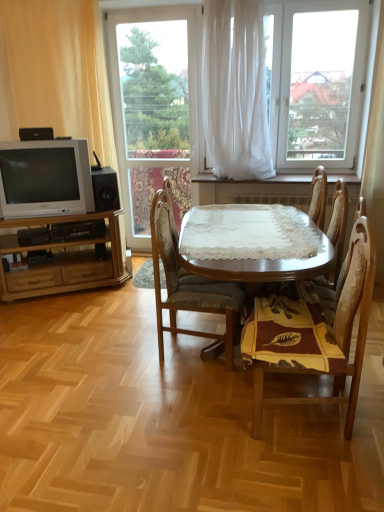
Describe the element at coordinates (45, 178) in the screenshot. I see `matte silver television at left` at that location.

The height and width of the screenshot is (512, 384). Identify the location of matte silver television at left. [45, 178].

Where is `transparent glass window at center, arranged as the 1th window when viewed from the left`? transparent glass window at center, arranged as the 1th window when viewed from the left is located at coordinates (155, 106).

Measure the distance between transparent glass window at center, arranged as the 1th window when viewed from the left, and camera.

They are 11.36 feet apart.

Measure the distance between black matte speaker at lower left, which appears as the first loudspeaker when viewed from the right, and camera.

Result: The depth of black matte speaker at lower left, which appears as the first loudspeaker when viewed from the right, is 11.35 feet.

Describe the element at coordinates (36, 134) in the screenshot. I see `black plastic speaker at upper left, which ranks as the second loudspeaker in right-to-left order` at that location.

Where is `light brown wood entertainment center at left`? light brown wood entertainment center at left is located at coordinates (61, 260).

This screenshot has width=384, height=512. What do you see at coordinates (315, 81) in the screenshot?
I see `white sheer curtain at upper center, placed as the second window when sorted from left to right` at bounding box center [315, 81].

At what (x,y) coordinates should I click in order to perform the action: click on white sheer curtain at center, the 2th curtain positioned from the left. Please return your answer as a coordinate pair (x, y). Looking at the image, I should click on (235, 89).

What's the angular difference between wooden chair at center, the second chair positioned from the right, and light brown wood entertainment center at left's facing directions?

120 degrees.

Considering the relative sizes of wooden chair at center, the second chair positioned from the right, and light brown wood entertainment center at left in the image provided, is wooden chair at center, the second chair positioned from the right, bigger than light brown wood entertainment center at left?

No, wooden chair at center, the second chair positioned from the right, is not bigger than light brown wood entertainment center at left.

Considering the relative positions of wooden chair at center, arranged as the 2th chair when viewed from the left, and light brown wood entertainment center at left in the image provided, is wooden chair at center, arranged as the 2th chair when viewed from the left, to the left or to the right of light brown wood entertainment center at left?

In the image, wooden chair at center, arranged as the 2th chair when viewed from the left, appears on the right side of light brown wood entertainment center at left.

Is wooden chair at center, arranged as the 2th chair when viewed from the left, facing away from light brown wood entertainment center at left?

No, wooden chair at center, arranged as the 2th chair when viewed from the left,'s orientation is not away from light brown wood entertainment center at left.

Is white sheer curtain at center, the 1th curtain in the right-to-left sequence, oriented away from wooden chair at center, the second chair positioned from the right?

No, wooden chair at center, the second chair positioned from the right, is not at the back of white sheer curtain at center, the 1th curtain in the right-to-left sequence.

Considering the sizes of objects white sheer curtain at center, the 2th curtain positioned from the left, and wooden chair at center, arranged as the 2th chair when viewed from the left, in the image provided, who is bigger, white sheer curtain at center, the 2th curtain positioned from the left, or wooden chair at center, arranged as the 2th chair when viewed from the left,?

Bigger between the two is white sheer curtain at center, the 2th curtain positioned from the left.

Can you confirm if white sheer curtain at center, the 1th curtain in the right-to-left sequence, is taller than wooden chair at center, arranged as the 2th chair when viewed from the left?

Correct, white sheer curtain at center, the 1th curtain in the right-to-left sequence, is much taller as wooden chair at center, arranged as the 2th chair when viewed from the left.

Considering the relative positions of black plastic speaker at upper left, which is the 1th loudspeaker from left to right, and wooden table at center in the image provided, is black plastic speaker at upper left, which is the 1th loudspeaker from left to right, behind wooden table at center?

That is True.

Is wooden table at center located within black plastic speaker at upper left, which is the first loudspeaker from front to back?

No, wooden table at center is not surrounded by black plastic speaker at upper left, which is the first loudspeaker from front to back.

Who is taller, black plastic speaker at upper left, which ranks as the second loudspeaker in right-to-left order, or wooden table at center?

With more height is wooden table at center.

Which of these two, black plastic speaker at upper left, which appears as the 2th loudspeaker when viewed from the back, or wooden table at center, is bigger?

wooden table at center.

Find the location of `window lying above the white sheer curtain at center, the 2th curtain positioned from the left (from the image's perspective)`. window lying above the white sheer curtain at center, the 2th curtain positioned from the left (from the image's perspective) is located at coordinates (315, 81).

Is white sheer curtain at center, the 2th curtain positioned from the left, looking in the opposite direction of white sheer curtain at upper center, which appears as the first window when viewed from the right?

Correct, white sheer curtain at center, the 2th curtain positioned from the left, is looking away from white sheer curtain at upper center, which appears as the first window when viewed from the right.

Who is shorter, white sheer curtain at center, the 1th curtain in the right-to-left sequence, or white sheer curtain at upper center, which appears as the first window when viewed from the right?

white sheer curtain at upper center, which appears as the first window when viewed from the right, is shorter.

Could black plastic speaker at upper left, which appears as the 2th loudspeaker when viewed from the back, be considered to be inside matte silver television at left?

No, black plastic speaker at upper left, which appears as the 2th loudspeaker when viewed from the back, is not inside matte silver television at left.

From a real-world perspective, is matte silver television at left physically located above or below black plastic speaker at upper left, the second loudspeaker when ordered from bottom to top?

Clearly, from a real-world perspective, matte silver television at left is below black plastic speaker at upper left, the second loudspeaker when ordered from bottom to top.

Does point (72, 189) come behind point (21, 133)?

Yes, it is behind point (21, 133).

How distant is wooden chair at center, which is the 1th chair from right to left, from wooden chair at center, the third chair viewed from the right?

A distance of 3.57 feet exists between wooden chair at center, which is the 1th chair from right to left, and wooden chair at center, the third chair viewed from the right.

Looking at this image, between wooden chair at center, positioned as the third chair in left-to-right order, and wooden chair at center, the third chair viewed from the right, which one appears on the right side from the viewer's perspective?

wooden chair at center, positioned as the third chair in left-to-right order.

Is point (315, 211) positioned after point (198, 335)?

Yes, point (315, 211) is behind point (198, 335).

Which of these two, matte silver television at left or wooden chair at center, the second chair positioned from the right, stands shorter?

With less height is matte silver television at left.

Is the surface of matte silver television at left in direct contact with wooden chair at center, the second chair positioned from the right?

No, matte silver television at left is not in contact with wooden chair at center, the second chair positioned from the right.

Can you confirm if matte silver television at left is smaller than wooden chair at center, the second chair positioned from the right?

Yes, matte silver television at left is smaller than wooden chair at center, the second chair positioned from the right.

Find the location of a particular element. cabinetry above the wooden chair at center, arranged as the 2th chair when viewed from the left (from the image's perspective) is located at coordinates (61, 260).

Starting from the wooden chair at center, arranged as the 2th chair when viewed from the left, which curtain is the 1st one behind? Please provide its 2D coordinates.

[(235, 89)]

Estimate the real-world distances between objects in this image. Which object is further from white sheer curtain at center, the 1th curtain in the right-to-left sequence, wooden chair at center, the second chair positioned from the right, or matte silver television at left?

wooden chair at center, the second chair positioned from the right, is further to white sheer curtain at center, the 1th curtain in the right-to-left sequence.

Based on their spatial positions, is white sheer curtain at upper left, the 1th curtain in the left-to-right sequence, or wooden chair at center, the 1th chair from the left, closer to black matte speaker at lower left, which ranks as the first loudspeaker in bottom-to-top order?

white sheer curtain at upper left, the 1th curtain in the left-to-right sequence, is closer to black matte speaker at lower left, which ranks as the first loudspeaker in bottom-to-top order.

From the image, which object appears to be nearer to black plastic speaker at upper left, which is the first loudspeaker from front to back, wooden chair at center, which is the 1th chair from right to left, or wooden chair at center, the 1th chair from the left?

wooden chair at center, the 1th chair from the left, lies closer to black plastic speaker at upper left, which is the first loudspeaker from front to back, than the other object.

When comparing their distances from light brown wood entertainment center at left, does matte silver television at left or white sheer curtain at upper center, placed as the second window when sorted from left to right, seem further?

Based on the image, white sheer curtain at upper center, placed as the second window when sorted from left to right, appears to be further to light brown wood entertainment center at left.

From the image, which object appears to be nearer to wooden chair at center, the 1th chair from the left, wooden table at center or light brown wood entertainment center at left?

The object closer to wooden chair at center, the 1th chair from the left, is wooden table at center.

When comparing their distances from wooden chair at center, arranged as the 2th chair when viewed from the left, does light brown wood entertainment center at left or white sheer curtain at center, the 2th curtain positioned from the left, seem further?

The object further to wooden chair at center, arranged as the 2th chair when viewed from the left, is light brown wood entertainment center at left.

From the picture: Estimate the real-world distances between objects in this image. Which object is closer to wooden chair at center, arranged as the 2th chair when viewed from the left, transparent glass window at center, which ranks as the second window in right-to-left order, or wooden chair at center, the 1th chair from the left?

wooden chair at center, the 1th chair from the left.

From the image, which object appears to be nearer to white sheer curtain at upper center, which appears as the first window when viewed from the right, transparent glass window at center, which ranks as the second window in right-to-left order, or matte silver television at left?

Among the two, transparent glass window at center, which ranks as the second window in right-to-left order, is located nearer to white sheer curtain at upper center, which appears as the first window when viewed from the right.

Where is `loudspeaker between black plastic speaker at upper left, which is the 1th loudspeaker from left to right, and light brown wood entertainment center at left in the up-down direction`? loudspeaker between black plastic speaker at upper left, which is the 1th loudspeaker from left to right, and light brown wood entertainment center at left in the up-down direction is located at coordinates (105, 189).

Locate an element on the screen. The width and height of the screenshot is (384, 512). round table between white sheer curtain at upper left, the 1th curtain in the left-to-right sequence, and wooden chair at center, the second chair positioned from the right, from left to right is located at coordinates (254, 259).

You are a GUI agent. You are given a task and a screenshot of the screen. Output one action in this format:
    pyautogui.click(x=<x>, y=<y>)
    Task: Click on the curtain situated between light brown wood entertainment center at left and wooden chair at center, the third chair viewed from the right, from left to right
    
    Given the screenshot: What is the action you would take?
    pyautogui.click(x=57, y=71)

The width and height of the screenshot is (384, 512). Identify the location of curtain situated between white sheer curtain at upper left, which is the second curtain from right to left, and wooden chair at center, positioned as the third chair in left-to-right order, from left to right. (235, 89).